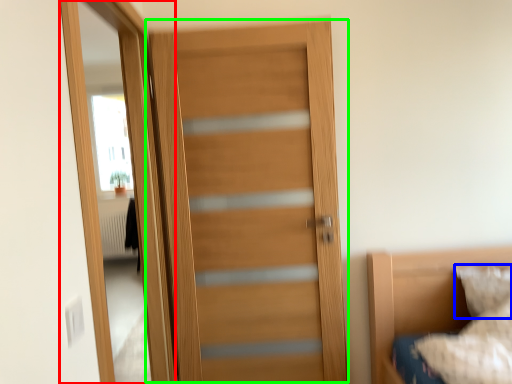
Question: Which object is positioned farthest from screen door (highlighted by a red box)? Select from pillow (highlighted by a blue box) and door (highlighted by a green box).

Choices:
 (A) pillow
 (B) door

Answer: (A)